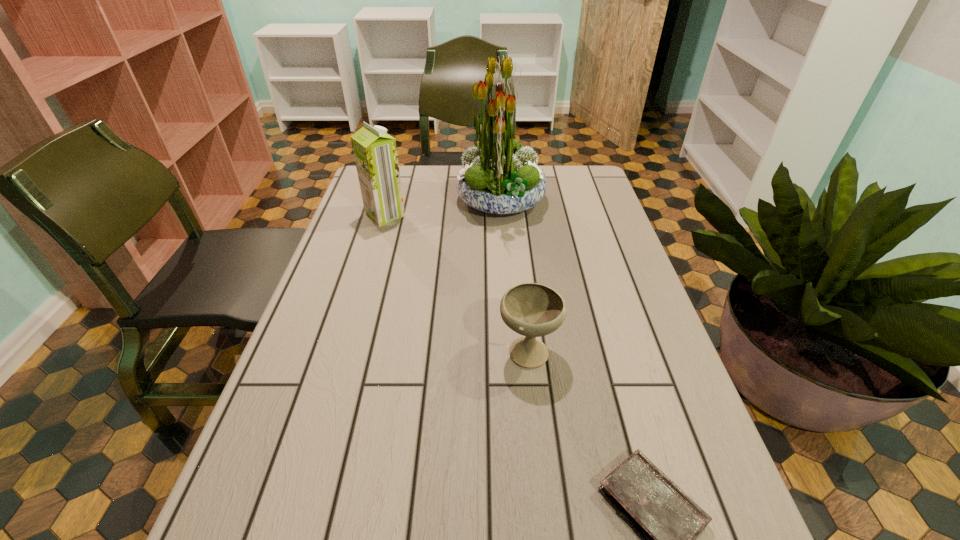
Where is `the tallest object`? The height and width of the screenshot is (540, 960). the tallest object is located at coordinates (499, 176).

The width and height of the screenshot is (960, 540). Find the location of `soya milk`. soya milk is located at coordinates (375, 152).

Where is `the second tallest object`? This screenshot has height=540, width=960. the second tallest object is located at coordinates (375, 152).

Image resolution: width=960 pixels, height=540 pixels. Find the location of `the second nearest object`. the second nearest object is located at coordinates (533, 310).

Locate an element on the screen. the third tallest object is located at coordinates pyautogui.click(x=533, y=310).

Identify the location of vacant position located 0.320m on the front-facing side of the tallest object. (355, 201).

The image size is (960, 540). In order to click on free space located on the front-facing side of the tallest object in this screenshot , I will do `click(431, 201)`.

Image resolution: width=960 pixels, height=540 pixels. Identify the location of vacant space positioned on the front-facing side of the tallest object. [x=425, y=201].

Identify the location of free region located 0.050m on the front of the second tallest object. (379, 237).

Image resolution: width=960 pixels, height=540 pixels. I want to click on free spot located on the back of the second shortest object, so click(x=516, y=235).